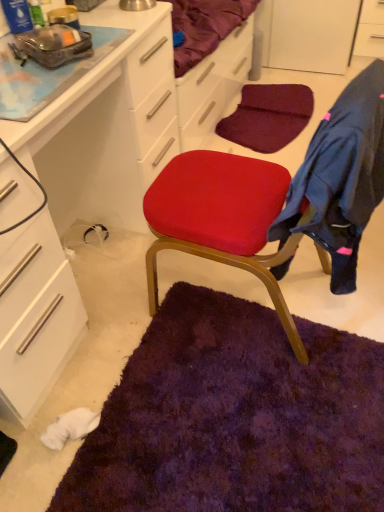
Question: Can you confirm if matte white cabinet at center, placed as the 1th cabinetry when sorted from left to right, is thinner than white glossy cabinet at upper right, acting as the 2th cabinetry starting from the bottom?

Choices:
 (A) no
 (B) yes

Answer: (A)

Question: Is matte white cabinet at center, which is the first cabinetry in bottom-to-top order, to the right of white glossy cabinet at upper right, which ranks as the 2th cabinetry in left-to-right order, from the viewer's perspective?

Choices:
 (A) no
 (B) yes

Answer: (A)

Question: Is matte white cabinet at center, which is counted as the 2th cabinetry, starting from the back, directly adjacent to white glossy cabinet at upper right, acting as the 2th cabinetry starting from the bottom?

Choices:
 (A) no
 (B) yes

Answer: (A)

Question: Are matte white cabinet at center, which ranks as the 2th cabinetry in right-to-left order, and white glossy cabinet at upper right, the 2th cabinetry viewed from the front, far apart?

Choices:
 (A) no
 (B) yes

Answer: (B)

Question: Is matte white cabinet at center, the 2th cabinetry viewed from the top, bigger than white glossy cabinet at upper right, acting as the 2th cabinetry starting from the bottom?

Choices:
 (A) no
 (B) yes

Answer: (B)

Question: In terms of size, does white glossy cabinet at upper right, which appears as the first cabinetry when viewed from the back, appear bigger or smaller than dark blue fleece jacket at right?

Choices:
 (A) big
 (B) small

Answer: (B)

Question: In terms of width, does white glossy cabinet at upper right, which ranks as the 2th cabinetry in left-to-right order, look wider or thinner when compared to dark blue fleece jacket at right?

Choices:
 (A) wide
 (B) thin

Answer: (A)

Question: Does point (365, 48) appear closer or farther from the camera than point (372, 61)?

Choices:
 (A) farther
 (B) closer

Answer: (A)

Question: Choose the correct answer: Is white glossy cabinet at upper right, the 2th cabinetry viewed from the front, inside dark blue fleece jacket at right or outside it?

Choices:
 (A) inside
 (B) outside

Answer: (B)

Question: Is matte white cabinet at center, which ranks as the 2th cabinetry in right-to-left order, in front of or behind dark blue fleece jacket at right in the image?

Choices:
 (A) front
 (B) behind

Answer: (A)

Question: Is point (8, 281) positioned closer to the camera than point (327, 217)?

Choices:
 (A) farther
 (B) closer

Answer: (A)

Question: Would you say matte white cabinet at center, which is counted as the 2th cabinetry, starting from the back, is inside or outside dark blue fleece jacket at right?

Choices:
 (A) outside
 (B) inside

Answer: (A)

Question: From the image's perspective, is matte white cabinet at center, the 1th cabinetry positioned from the front, above or below dark blue fleece jacket at right?

Choices:
 (A) above
 (B) below

Answer: (A)

Question: Relative to matte white cabinet at center, the 2th cabinetry viewed from the top, is dark blue fleece jacket at right in front or behind?

Choices:
 (A) behind
 (B) front

Answer: (A)

Question: From the image's perspective, is dark blue fleece jacket at right positioned above or below matte white cabinet at center, the 2th cabinetry viewed from the top?

Choices:
 (A) below
 (B) above

Answer: (A)